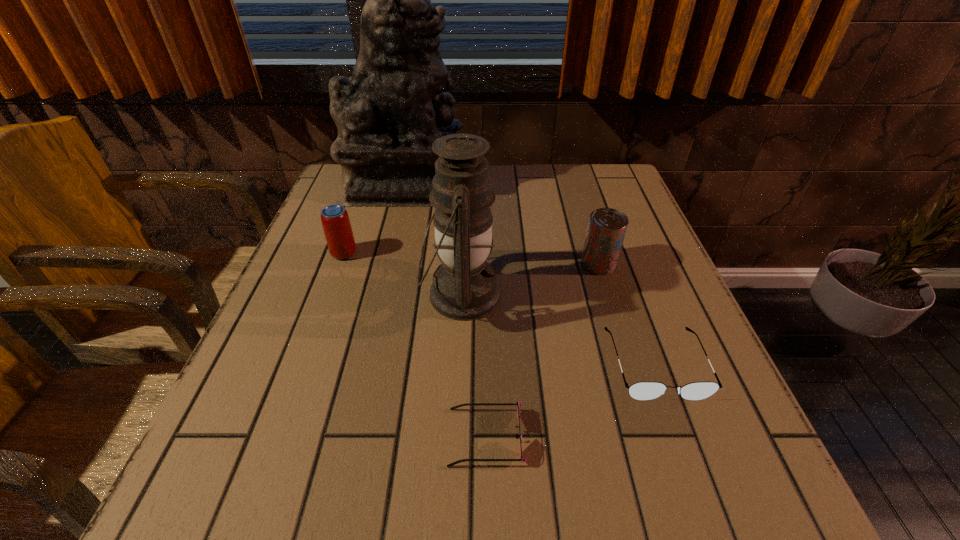
You are a GUI agent. You are given a task and a screenshot of the screen. Output one action in this format:
    pyautogui.click(x=<x>, y=<y>)
    Task: Click on the beer can that is at the right edge
    The height and width of the screenshot is (540, 960).
    Given the screenshot: What is the action you would take?
    pyautogui.click(x=606, y=230)

Identify the location of spectacles at the right edge. (643, 391).

This screenshot has height=540, width=960. What are the coordinates of `object located in the far left corner section of the desktop` in the screenshot? It's located at (395, 106).

I want to click on vacant space at the far edge, so click(x=558, y=171).

This screenshot has width=960, height=540. In the image, there is a desktop. Identify the location of vacant space at the near edge. (361, 509).

The image size is (960, 540). Identify the location of vacant point at the left edge. (316, 369).

This screenshot has height=540, width=960. Identify the location of vacant region at the far right corner of the desktop. (609, 173).

Locate an element on the screen. This screenshot has height=540, width=960. free spot between the fifth shortest object and the shortest object is located at coordinates (473, 366).

Locate an element on the screen. free space between the nearest object and the right beer can is located at coordinates (542, 350).

Where is `free space between the second shortest object and the fifth shortest object`? free space between the second shortest object and the fifth shortest object is located at coordinates (559, 329).